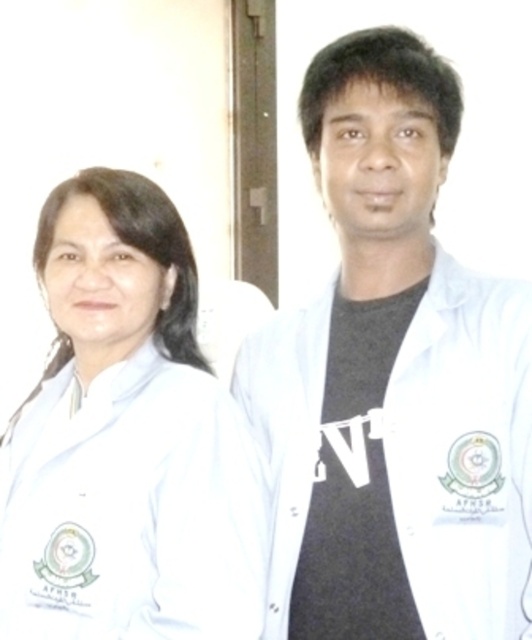
Question: Which of the following is the closest to the observer?

Choices:
 (A) white matte lab coat at right
 (B) white matte lab coat at left

Answer: (A)

Question: Can you confirm if white matte lab coat at left is positioned above white matte lab coat at right?

Choices:
 (A) yes
 (B) no

Answer: (A)

Question: Is white matte lab coat at left positioned behind white matte lab coat at right?

Choices:
 (A) no
 (B) yes

Answer: (B)

Question: Which object appears farthest from the camera in this image?

Choices:
 (A) white matte lab coat at left
 (B) white matte lab coat at right

Answer: (A)

Question: Is white matte lab coat at left thinner than white matte lab coat at right?

Choices:
 (A) yes
 (B) no

Answer: (B)